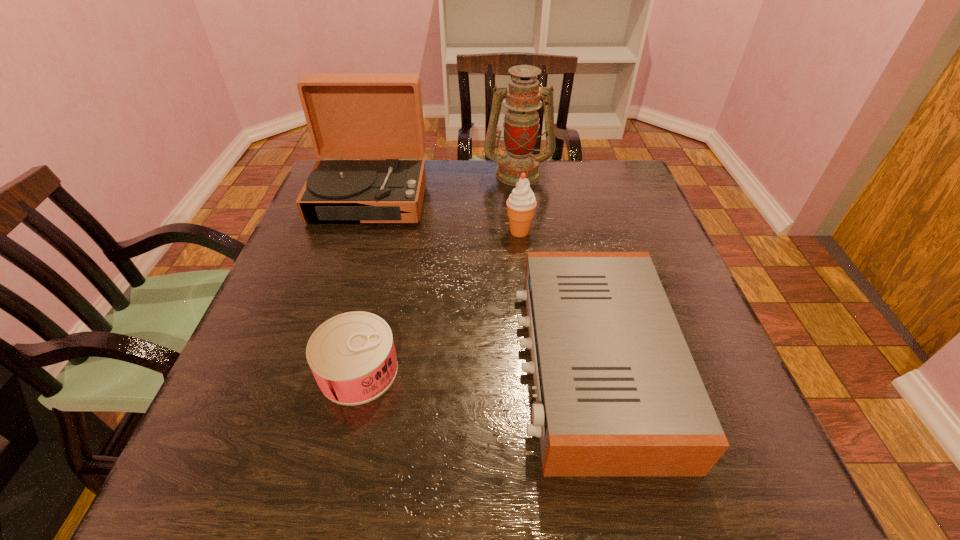
At what (x,y) coordinates should I click in order to perform the action: click on vacant position at the far edge of the desktop. Please return your answer as a coordinate pair (x, y). Looking at the image, I should click on (434, 169).

The image size is (960, 540). I want to click on blank space at the left edge, so click(246, 357).

Locate an element on the screen. The height and width of the screenshot is (540, 960). free spot at the right edge of the desktop is located at coordinates (x=630, y=244).

Find the location of a particular element. blank space at the far right corner of the desktop is located at coordinates (630, 183).

At what (x,y) coordinates should I click in order to perform the action: click on vacant space in between the icecream and the can. Please return your answer as a coordinate pair (x, y). Looking at the image, I should click on (439, 301).

The image size is (960, 540). I want to click on free space between the oil lamp and the phonograph record, so click(x=444, y=185).

Locate an element on the screen. Image resolution: width=960 pixels, height=540 pixels. free space that is in between the shortest object and the radio receiver is located at coordinates (475, 367).

Find the location of `vacant area that lies between the icecream and the phonograph record`. vacant area that lies between the icecream and the phonograph record is located at coordinates (444, 214).

The width and height of the screenshot is (960, 540). Identify the location of free space between the oil lamp and the phonograph record. coord(444,185).

Image resolution: width=960 pixels, height=540 pixels. I want to click on unoccupied area between the phonograph record and the icecream, so click(444, 214).